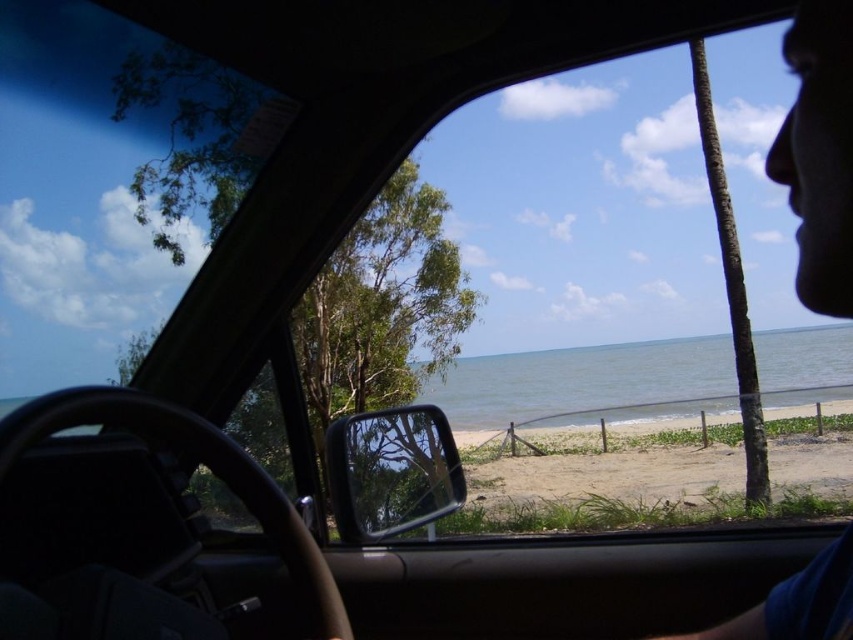
Who is taller, sandy beach at lower center or blue fabric face at upper right?

sandy beach at lower center

Who is higher up, sandy beach at lower center or blue fabric face at upper right?

blue fabric face at upper right

You are a GUI agent. You are given a task and a screenshot of the screen. Output one action in this format:
    pyautogui.click(x=<x>, y=<y>)
    Task: Click on the sandy beach at lower center
    The image size is (853, 640).
    Given the screenshot: What is the action you would take?
    pyautogui.click(x=529, y=476)

At what (x,y) coordinates should I click in order to perform the action: click on sandy beach at lower center. Please return your answer as a coordinate pair (x, y). Image resolution: width=853 pixels, height=640 pixels. Looking at the image, I should click on (529, 476).